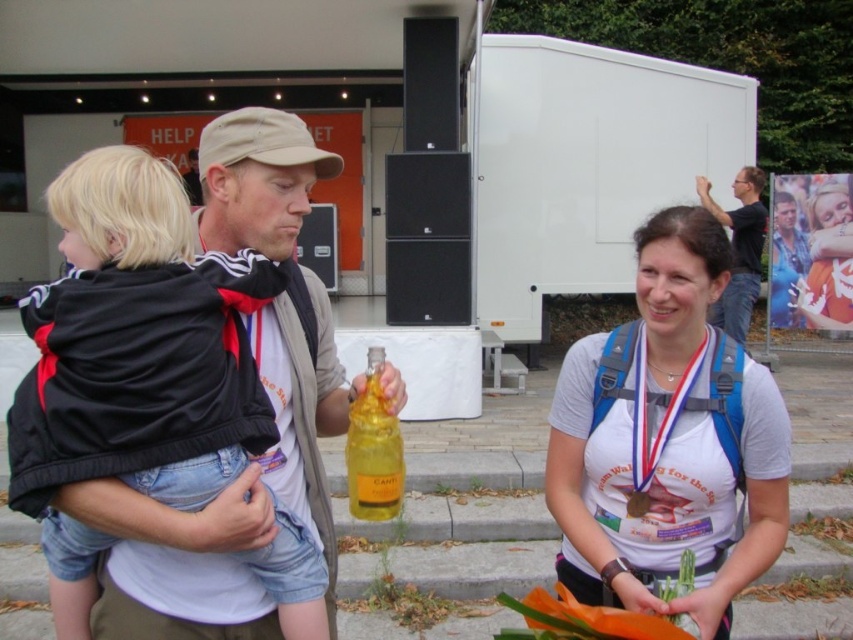
Question: Which point appears closest to the camera in this image?

Choices:
 (A) (743, 212)
 (B) (379, 484)
 (C) (811, 317)

Answer: (B)

Question: In this image, where is black fleece jacket at left located relative to white cotton t-shirt at center?

Choices:
 (A) above
 (B) below

Answer: (A)

Question: Estimate the real-world distances between objects in this image. Which object is farther from the matte black t-shirt at upper right?

Choices:
 (A) translucent yellow glass bottle at center
 (B) matte white t-shirt at center
 (C) white cotton t-shirt at center

Answer: (A)

Question: Is translucent yellow glass bottle at center to the left of matte white t-shirt at center from the viewer's perspective?

Choices:
 (A) no
 (B) yes

Answer: (B)

Question: Which object is positioned farthest from the matte black t-shirt at upper right?

Choices:
 (A) matte white t-shirt at center
 (B) black fleece jacket at left
 (C) translucent yellow glass bottle at center

Answer: (B)

Question: Is translucent yellow glass bottle at center above matte black t-shirt at upper right?

Choices:
 (A) no
 (B) yes

Answer: (A)